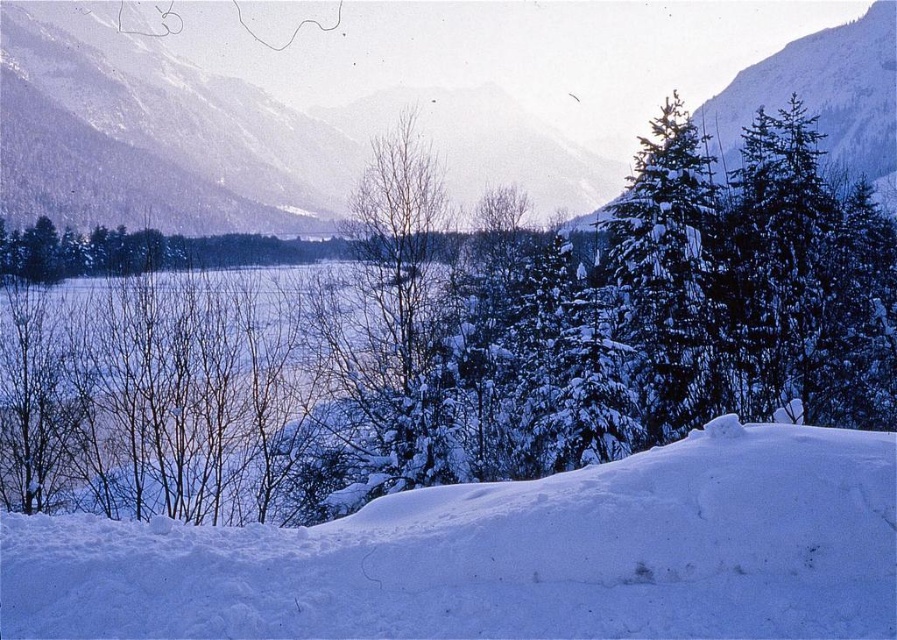
Question: Can you confirm if white snow at lower center is smaller than snow-covered evergreen at center-right?

Choices:
 (A) yes
 (B) no

Answer: (A)

Question: Does white snow at lower center lie behind snowy mountain at upper center?

Choices:
 (A) yes
 (B) no

Answer: (B)

Question: Which object is the farthest from the white snow at lower center?

Choices:
 (A) snow-covered evergreen at center-right
 (B) snowy mountain at upper center

Answer: (B)

Question: Which object is closer to the camera taking this photo?

Choices:
 (A) snowy mountain at upper center
 (B) white snow at lower center
 (C) snow-covered evergreen at center-right

Answer: (B)

Question: Is white snow at lower center above snow-covered evergreen at center-right?

Choices:
 (A) yes
 (B) no

Answer: (B)

Question: Which point is closer to the camera?

Choices:
 (A) snowy mountain at upper center
 (B) snow-covered evergreen at center-right

Answer: (B)